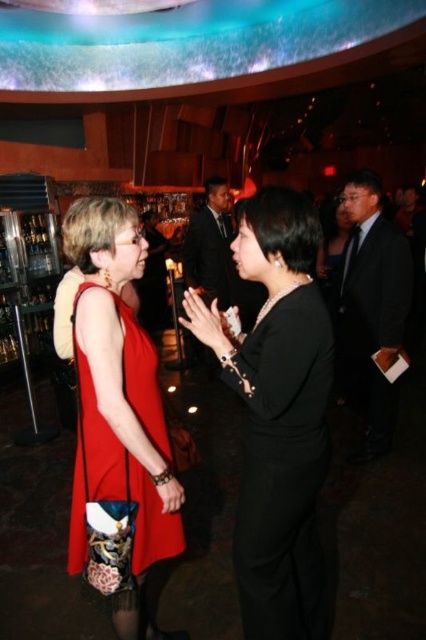
You are a photographer at this event and want to capture both the black satin dress at center and the matte red dress at center in the same frame. Which dress should you focus on first to ensure both are in the shot?

The black satin dress at center is positioned on the right side of the matte red dress at center, so focusing on the matte red dress at center first would allow the photographer to frame both dresses with the black satin dress at center to the right.

You are at a party and want to find the matte red dress at center. According to the coordinates given, where should you look in the image?

The matte red dress at center is located at the 2D coordinates point (114, 484) in the image.

You are a photographer at this event and need to position two subjects for a photo. The subjects are wearing the black satin dress at center and the dark suit at right. Based on their clothing widths, which subject should stand closer to the camera to avoid appearing too small in the photo?

The black satin dress at center should stand closer to the camera because its width is greater than the dark suit at right, allowing it to maintain a balanced appearance in the photo.